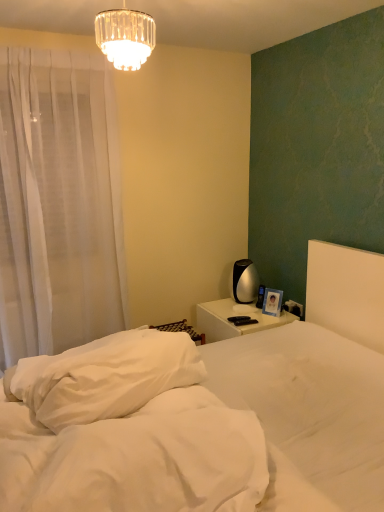
Find the location of `crystal glass chandelier at upper center`. crystal glass chandelier at upper center is located at coordinates click(125, 37).

What do you see at coordinates (58, 204) in the screenshot? Image resolution: width=384 pixels, height=512 pixels. I see `white sheer curtain at left` at bounding box center [58, 204].

At what (x,y) coordinates should I click in order to perform the action: click on white soft mattress at lower center. Please return your answer as a coordinate pair (x, y). Looking at the image, I should click on (136, 459).

The height and width of the screenshot is (512, 384). Describe the element at coordinates (234, 315) in the screenshot. I see `white glossy nightstand at center` at that location.

You are a GUI agent. You are given a task and a screenshot of the screen. Output one action in this format:
    pyautogui.click(x=<x>, y=<y>)
    Task: Click on the white soft pillow at left
    This screenshot has height=512, width=384.
    Given the screenshot: What is the action you would take?
    tap(106, 376)

Find the location of a particular element. black plastic electric outlet at right is located at coordinates (294, 308).

Where is `crystal glass chandelier at upper center`? Image resolution: width=384 pixels, height=512 pixels. crystal glass chandelier at upper center is located at coordinates (125, 37).

Between white soft mattress at lower center and matte blue photo frame at right, which one has larger width?

With larger width is white soft mattress at lower center.

Is white soft mattress at lower center to the left or to the right of matte blue photo frame at right in the image?

white soft mattress at lower center is to the left of matte blue photo frame at right.

Could you tell me if white soft mattress at lower center is turned towards matte blue photo frame at right?

No.

Is white soft mattress at lower center positioned behind matte blue photo frame at right?

That is False.

Considering the points (287, 302) and (153, 417), which point is behind, point (287, 302) or point (153, 417)?

The point (287, 302) is more distant.

Does black plastic electric outlet at right have a greater height compared to white soft mattress at lower center?

In fact, black plastic electric outlet at right may be shorter than white soft mattress at lower center.

Do you think black plastic electric outlet at right is within white soft mattress at lower center, or outside of it?

black plastic electric outlet at right is spatially situated outside white soft mattress at lower center.

What's the angular difference between black plastic electric outlet at right and white soft mattress at lower center's facing directions?

66.3 degrees.

From the image's perspective, is matte blue photo frame at right above or below white soft bed at center?

Based on their image positions, matte blue photo frame at right is located above white soft bed at center.

Is point (265, 300) closer to camera compared to point (86, 346)?

That is False.

Is white soft bed at center surrounded by matte blue photo frame at right?

No, white soft bed at center is not a part of matte blue photo frame at right.

From their relative heights in the image, would you say matte blue photo frame at right is taller or shorter than white soft bed at center?

matte blue photo frame at right is shorter than white soft bed at center.

From the image's perspective, does crystal glass chandelier at upper center appear lower than black plastic electric outlet at right?

Actually, crystal glass chandelier at upper center appears above black plastic electric outlet at right in the image.

Is crystal glass chandelier at upper center beside black plastic electric outlet at right?

crystal glass chandelier at upper center and black plastic electric outlet at right are not in contact.

From a real-world perspective, who is located lower, crystal glass chandelier at upper center or black plastic electric outlet at right?

From a 3D spatial view, black plastic electric outlet at right is below.

Based on the photo, can you confirm if white soft pillow at left is thinner than white soft bed at center?

Indeed, white soft pillow at left has a lesser width compared to white soft bed at center.

From a real-world perspective, is white soft pillow at left physically located above or below white soft bed at center?

Clearly, from a real-world perspective, white soft pillow at left is above white soft bed at center.

From the image's perspective, is white soft pillow at left above or below white soft bed at center?

From the image's perspective, white soft pillow at left appears above white soft bed at center.

Can you confirm if white soft pillow at left is positioned to the right of white soft bed at center?

No, white soft pillow at left is not to the right of white soft bed at center.

From the image's perspective, is matte blue photo frame at right on white soft pillow at left?

Indeed, from the image's perspective, matte blue photo frame at right is shown above white soft pillow at left.

Measure the distance from matte blue photo frame at right to white soft pillow at left.

matte blue photo frame at right and white soft pillow at left are 5.33 feet apart from each other.

Between matte blue photo frame at right and white soft pillow at left, which one has smaller width?

matte blue photo frame at right is thinner.

At what (x,y) coordinates should I click in order to perform the action: click on picture frame behind the white soft pillow at left. Please return your answer as a coordinate pair (x, y). The image size is (384, 512). Looking at the image, I should click on (272, 302).

Based on the photo, is crystal glass chandelier at upper center surrounded by matte blue photo frame at right?

Definitely not — crystal glass chandelier at upper center is not inside matte blue photo frame at right.

Which object is further away from the camera, matte blue photo frame at right or crystal glass chandelier at upper center?

matte blue photo frame at right is further from the camera.

Does matte blue photo frame at right have a greater width compared to crystal glass chandelier at upper center?

Incorrect, the width of matte blue photo frame at right does not surpass that of crystal glass chandelier at upper center.

Measure the distance between matte blue photo frame at right and crystal glass chandelier at upper center.

matte blue photo frame at right and crystal glass chandelier at upper center are 1.97 meters apart from each other.

You are a GUI agent. You are given a task and a screenshot of the screen. Output one action in this format:
    pyautogui.click(x=<x>, y=<y>)
    Task: Click on the mattress below the matte blue photo frame at right (from the image's perspective)
    The width and height of the screenshot is (384, 512).
    Given the screenshot: What is the action you would take?
    pyautogui.click(x=136, y=459)

Identify the location of electric outlet behind the white soft mattress at lower center. This screenshot has height=512, width=384. (294, 308).

From the image, which object appears to be nearer to white soft pillow at left, white soft mattress at lower center or black plastic electric outlet at right?

Among the two, white soft mattress at lower center is located nearer to white soft pillow at left.

Which object lies nearer to the anchor point white glossy nightstand at center, white soft bed at center or crystal glass chandelier at upper center?

white soft bed at center is closer to white glossy nightstand at center.

Estimate the real-world distances between objects in this image. Which object is further from white soft pillow at left, white soft bed at center or white sheer curtain at left?

Among the two, white sheer curtain at left is located further to white soft pillow at left.

Which object lies further to the anchor point white soft mattress at lower center, black plastic electric outlet at right or white sheer curtain at left?

black plastic electric outlet at right is positioned further to the anchor white soft mattress at lower center.

From the image, which object appears to be nearer to matte blue photo frame at right, white sheer curtain at left or white soft mattress at lower center?

Among the two, white sheer curtain at left is located nearer to matte blue photo frame at right.

When comparing their distances from white soft pillow at left, does white soft mattress at lower center or white soft bed at center seem closer?

Based on the image, white soft bed at center appears to be nearer to white soft pillow at left.

Considering their positions, is white soft pillow at left positioned further to white soft mattress at lower center than matte blue photo frame at right?

matte blue photo frame at right lies further to white soft mattress at lower center than the other object.

Which object lies further to the anchor point white soft pillow at left, crystal glass chandelier at upper center or white sheer curtain at left?

crystal glass chandelier at upper center lies further to white soft pillow at left than the other object.

You are a GUI agent. You are given a task and a screenshot of the screen. Output one action in this format:
    pyautogui.click(x=<x>, y=<y>)
    Task: Click on the lamp between white soft bed at center and black plastic electric outlet at right along the z-axis
    
    Given the screenshot: What is the action you would take?
    pyautogui.click(x=125, y=37)

Identify the location of pillow between crystal glass chandelier at upper center and white soft bed at center in the vertical direction. (106, 376).

Locate an element on the screen. picture frame between crystal glass chandelier at upper center and black plastic electric outlet at right along the z-axis is located at coordinates (272, 302).

At what (x,y) coordinates should I click in order to perform the action: click on lamp located between white sheer curtain at left and black plastic electric outlet at right in the left-right direction. Please return your answer as a coordinate pair (x, y). The height and width of the screenshot is (512, 384). Looking at the image, I should click on (125, 37).